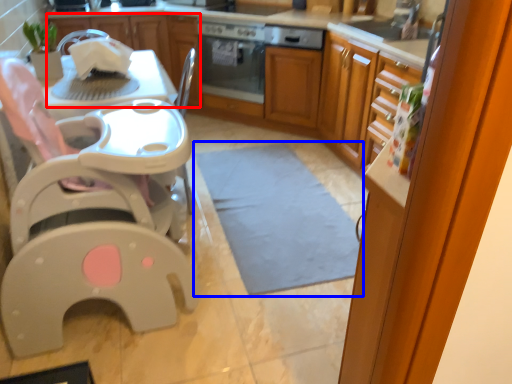
Question: Which point is further to the camera, cabinetry (highlighted by a red box) or mat (highlighted by a blue box)?

Choices:
 (A) cabinetry
 (B) mat

Answer: (A)